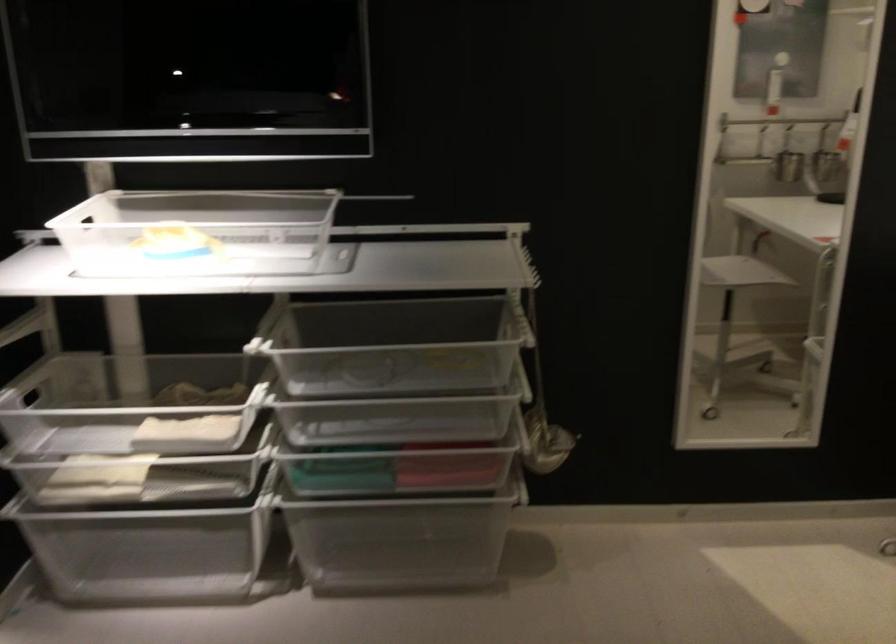
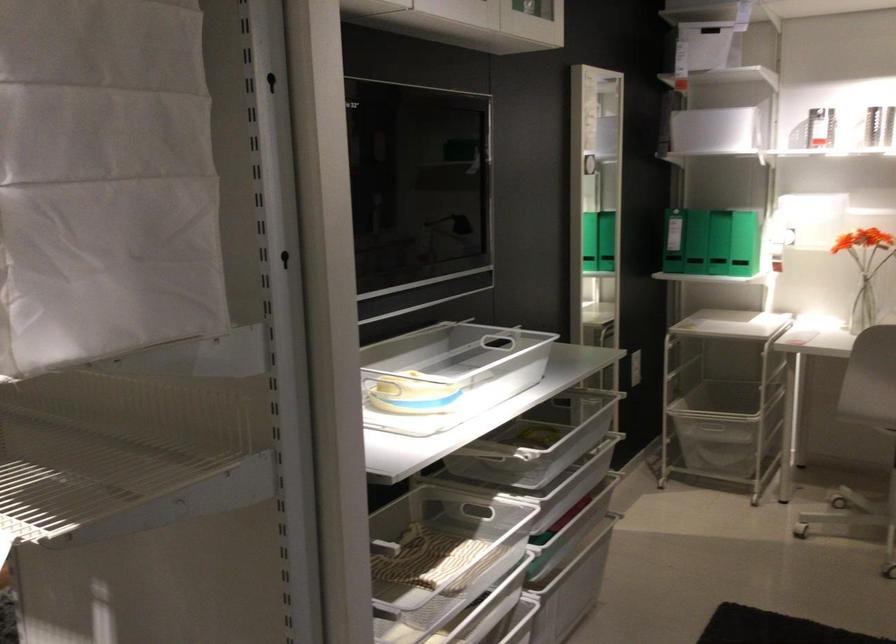
Question: I am providing you with two images of the same scene from different viewpoints. Please identify which objects are invisible in image2.

Choices:
 (A) plastic drawer handle
 (B) small panel lock
 (C) wire drawer front
 (D) metal ladle

Answer: (D)